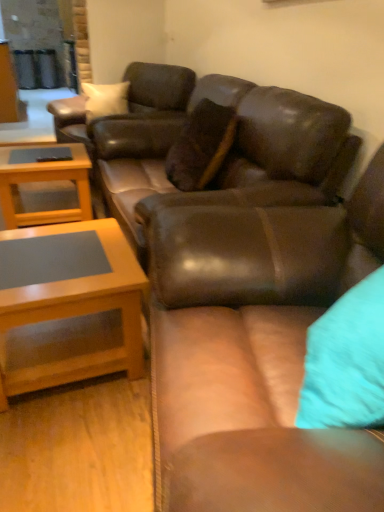
Question: Can you see brown leather swivel chair at center touching matte brown leather couch at center, the 2th studio couch from the front?

Choices:
 (A) no
 (B) yes

Answer: (A)

Question: Is brown leather swivel chair at center wider than matte brown leather couch at center, the 2th studio couch from the front?

Choices:
 (A) yes
 (B) no

Answer: (A)

Question: Is brown leather swivel chair at center looking in the opposite direction of matte brown leather couch at center, which is the 1th studio couch from back to front?

Choices:
 (A) no
 (B) yes

Answer: (A)

Question: Is brown leather swivel chair at center smaller than matte brown leather couch at center, the 2th studio couch from the front?

Choices:
 (A) no
 (B) yes

Answer: (B)

Question: Is brown leather swivel chair at center at the right side of matte brown leather couch at center, the 2th studio couch from the front?

Choices:
 (A) no
 (B) yes

Answer: (A)

Question: Is matte brown leather couch at center, the 2th studio couch from the front, wider or thinner than leather couch at center, marked as the 1th studio couch in a front-to-back arrangement?

Choices:
 (A) wide
 (B) thin

Answer: (B)

Question: From the image's perspective, relative to leather couch at center, marked as the 1th studio couch in a front-to-back arrangement, is matte brown leather couch at center, which is the 1th studio couch from back to front, above or below?

Choices:
 (A) above
 (B) below

Answer: (A)

Question: Is matte brown leather couch at center, which is the 1th studio couch from back to front, inside the boundaries of leather couch at center, marked as the 1th studio couch in a front-to-back arrangement, or outside?

Choices:
 (A) inside
 (B) outside

Answer: (B)

Question: In terms of height, does matte brown leather couch at center, the 2th studio couch from the front, look taller or shorter compared to leather couch at center, placed as the second studio couch when sorted from back to front?

Choices:
 (A) short
 (B) tall

Answer: (B)

Question: Is leather couch at center, marked as the 1th studio couch in a front-to-back arrangement, situated inside light brown wood coffee table at left, arranged as the 2th coffee table when ordered from the bottom, or outside?

Choices:
 (A) outside
 (B) inside

Answer: (A)

Question: Looking at their shapes, would you say leather couch at center, placed as the second studio couch when sorted from back to front, is wider or thinner than light brown wood coffee table at left, arranged as the 2th coffee table when ordered from the bottom?

Choices:
 (A) wide
 (B) thin

Answer: (A)

Question: From the image's perspective, is leather couch at center, marked as the 1th studio couch in a front-to-back arrangement, positioned above or below light brown wood coffee table at left, marked as the second coffee table in a front-to-back arrangement?

Choices:
 (A) below
 (B) above

Answer: (A)

Question: Would you say leather couch at center, placed as the second studio couch when sorted from back to front, is to the left or to the right of light brown wood coffee table at left, marked as the second coffee table in a front-to-back arrangement, in the picture?

Choices:
 (A) right
 (B) left

Answer: (A)

Question: From the image's perspective, is leather couch at center, marked as the 1th studio couch in a front-to-back arrangement, above or below light brown wood coffee table at lower left, the 2th coffee table when ordered from top to bottom?

Choices:
 (A) above
 (B) below

Answer: (B)

Question: Which is correct: leather couch at center, marked as the 1th studio couch in a front-to-back arrangement, is inside light brown wood coffee table at lower left, acting as the second coffee table starting from the back, or outside of it?

Choices:
 (A) inside
 (B) outside

Answer: (B)